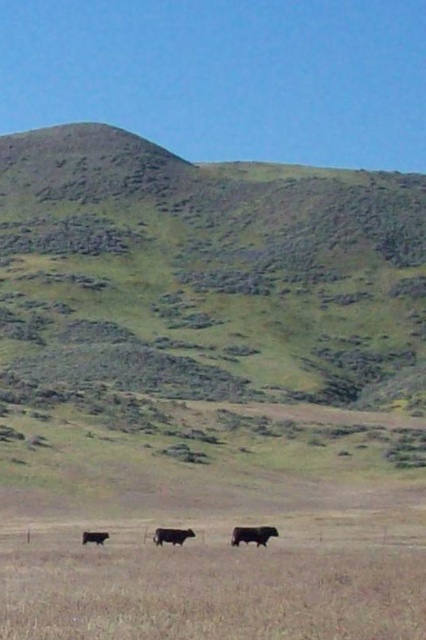
Where is `green grassy hillside at center`? This screenshot has width=426, height=640. green grassy hillside at center is located at coordinates (204, 316).

This screenshot has width=426, height=640. Identify the location of green grassy hillside at center. (204, 316).

Is green grassy hillside at center bigger than shiny brown cow at lower left?

Yes, green grassy hillside at center is bigger than shiny brown cow at lower left.

Does green grassy hillside at center have a lesser width compared to shiny brown cow at lower left?

No.

Describe the element at coordinates (204, 316) in the screenshot. I see `green grassy hillside at center` at that location.

Image resolution: width=426 pixels, height=640 pixels. I want to click on green grassy hillside at center, so click(x=204, y=316).

Can you confirm if black matte cow at center is taller than shiny brown cow at lower left?

Yes.

Is point (176, 538) positioned after point (83, 532)?

No, (176, 538) is in front of (83, 532).

Image resolution: width=426 pixels, height=640 pixels. In order to click on black matte cow at center in this screenshot , I will do `click(172, 536)`.